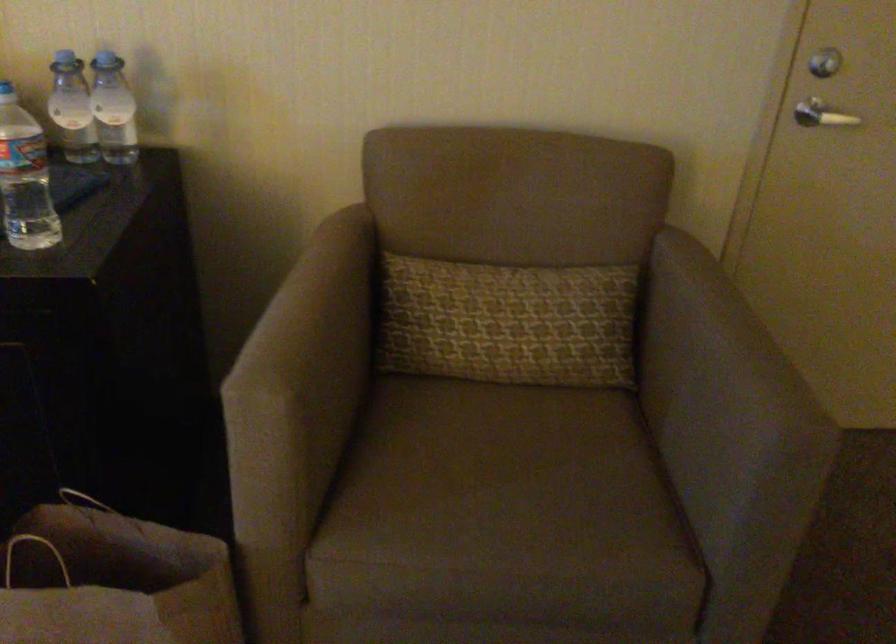
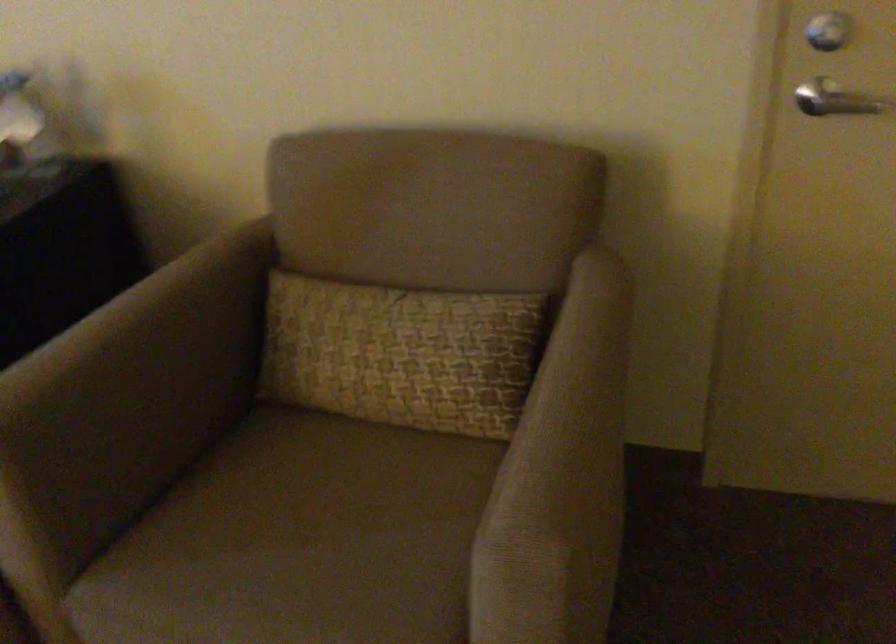
Find the pixel in the second image that matches the point at 773,351 in the first image.

(581, 424)